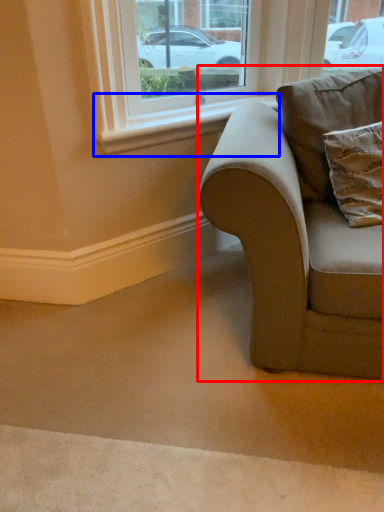
Question: Which of the following is the closest to the observer, studio couch (highlighted by a red box) or window sill (highlighted by a blue box)?

Choices:
 (A) studio couch
 (B) window sill

Answer: (A)